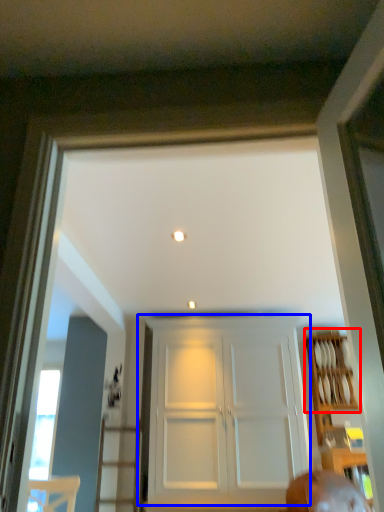
Question: Which of the following is the closest to the observer, shelf (highlighted by a red box) or door (highlighted by a blue box)?

Choices:
 (A) shelf
 (B) door

Answer: (B)